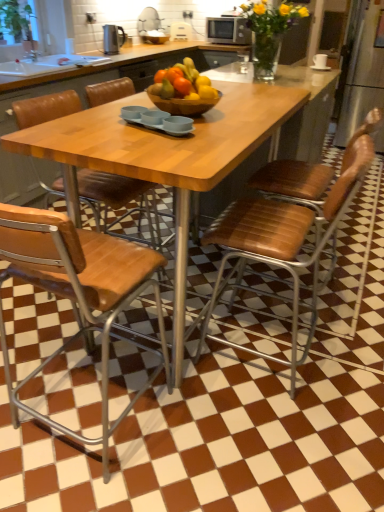
The width and height of the screenshot is (384, 512). What do you see at coordinates (78, 293) in the screenshot?
I see `wooden at center, marked as the second chair in a left-to-right arrangement` at bounding box center [78, 293].

I want to click on wooden at center, which is the 4th chair from right to left, so click(x=117, y=198).

Locate an element on the screen. The height and width of the screenshot is (512, 384). brown leather chair at center, acting as the third chair starting from the left is located at coordinates (282, 242).

Identify the location of wooden table at center. (164, 158).

Is brown leather chair at center, acting as the third chair starting from the left, completely or partially outside of wooden at center, positioned as the first chair in left-to-right order?

That's correct, brown leather chair at center, acting as the third chair starting from the left, is outside of wooden at center, positioned as the first chair in left-to-right order.

Does brown leather chair at center, arranged as the 2th chair when viewed from the right, turn towards wooden at center, which is the 4th chair from right to left?

Yes, brown leather chair at center, arranged as the 2th chair when viewed from the right, faces towards wooden at center, which is the 4th chair from right to left.

Can you confirm if brown leather chair at center, acting as the third chair starting from the left, is wider than wooden at center, positioned as the first chair in left-to-right order?

Correct, the width of brown leather chair at center, acting as the third chair starting from the left, exceeds that of wooden at center, positioned as the first chair in left-to-right order.

The image size is (384, 512). Find the location of `chair that is the 2nd object above the brown leather chair at center, acting as the third chair starting from the left (from a real-world perspective)`. chair that is the 2nd object above the brown leather chair at center, acting as the third chair starting from the left (from a real-world perspective) is located at coordinates [117, 198].

Does wooden table at center lie behind translucent glass vase at upper center?

No, the depth of wooden table at center is less than that of translucent glass vase at upper center.

Which object is thinner, wooden table at center or translucent glass vase at upper center?

translucent glass vase at upper center.

From a real-world perspective, is wooden table at center above or below translucent glass vase at upper center?

Clearly, from a real-world perspective, wooden table at center is below translucent glass vase at upper center.

Locate an element on the screen. The width and height of the screenshot is (384, 512). kitchen & dining room table in front of the translucent glass vase at upper center is located at coordinates (164, 158).

Is wooden at center, marked as the second chair in a left-to-right arrangement, at the left side of matte silver microwave at upper center, acting as the 1th appliance starting from the top?

Indeed, wooden at center, marked as the second chair in a left-to-right arrangement, is positioned on the left side of matte silver microwave at upper center, acting as the 1th appliance starting from the top.

Is matte silver microwave at upper center, which is the first appliance in right-to-left order, a part of wooden at center, arranged as the third chair when viewed from the right?

No, matte silver microwave at upper center, which is the first appliance in right-to-left order, is not a part of wooden at center, arranged as the third chair when viewed from the right.

From the image's perspective, would you say wooden at center, marked as the second chair in a left-to-right arrangement, is positioned over matte silver microwave at upper center, acting as the 1th appliance starting from the top?

No.

Considering the sizes of objects wooden at center, marked as the second chair in a left-to-right arrangement, and matte silver microwave at upper center, which is the first appliance in right-to-left order, in the image provided, who is thinner, wooden at center, marked as the second chair in a left-to-right arrangement, or matte silver microwave at upper center, which is the first appliance in right-to-left order,?

matte silver microwave at upper center, which is the first appliance in right-to-left order.

From the image's perspective, which is below, brown leather chair at center, arranged as the 2th chair when viewed from the right, or matte silver microwave at upper center, which is the 1th appliance in back-to-front order?

brown leather chair at center, arranged as the 2th chair when viewed from the right, from the image's perspective.

Are brown leather chair at center, acting as the third chair starting from the left, and matte silver microwave at upper center, marked as the 2th appliance in a left-to-right arrangement, located far from each other?

Yes, brown leather chair at center, acting as the third chair starting from the left, and matte silver microwave at upper center, marked as the 2th appliance in a left-to-right arrangement, are quite far apart.

Is brown leather chair at center, arranged as the 2th chair when viewed from the right, looking in the opposite direction of matte silver microwave at upper center, which is the 2th appliance in bottom-to-top order?

brown leather chair at center, arranged as the 2th chair when viewed from the right, is not turned away from matte silver microwave at upper center, which is the 2th appliance in bottom-to-top order.

What are the coordinates of `the 2nd appliance above the brown leather chair at center, acting as the third chair starting from the left (from the image's perspective)` in the screenshot? It's located at (228, 30).

From the image's perspective, is brown leather chair at center, acting as the third chair starting from the left, above wooden at center, arranged as the third chair when viewed from the right?

Correct, brown leather chair at center, acting as the third chair starting from the left, appears higher than wooden at center, arranged as the third chair when viewed from the right, in the image.

Are brown leather chair at center, arranged as the 2th chair when viewed from the right, and wooden at center, marked as the second chair in a left-to-right arrangement, located far from each other?

Result: That's not correct — brown leather chair at center, arranged as the 2th chair when viewed from the right, is a little close to wooden at center, marked as the second chair in a left-to-right arrangement.

Is wooden at center, marked as the second chair in a left-to-right arrangement, surrounded by brown leather chair at center, acting as the third chair starting from the left?

No.

Is wooden table at center to the left of black plastic kettle at upper left, which is counted as the first appliance, starting from the left, from the viewer's perspective?

In fact, wooden table at center is to the right of black plastic kettle at upper left, which is counted as the first appliance, starting from the left.

Which is closer to the camera, (135, 104) or (114, 29)?

Point (135, 104) appears to be closer to the viewer than point (114, 29).

Which object is further away from the camera taking this photo, wooden table at center or black plastic kettle at upper left, which is the 2th appliance in top-to-bottom order?

Positioned behind is black plastic kettle at upper left, which is the 2th appliance in top-to-bottom order.

This screenshot has height=512, width=384. I want to click on appliance that is the 1st one above the wooden table at center (from a real-world perspective), so (113, 39).

Looking at this image, is brown leather chair at right, the 1th chair when ordered from right to left, completely or partially outside of matte silver microwave at upper center, which is the 2th appliance in bottom-to-top order?

Yes.

Can you confirm if brown leather chair at right, the 1th chair when ordered from right to left, is taller than matte silver microwave at upper center, which is the 2th appliance in bottom-to-top order?

Yes.

Is brown leather chair at right, the 1th chair when ordered from right to left, turned away from matte silver microwave at upper center, which is the 2th appliance in bottom-to-top order?

No, brown leather chair at right, the 1th chair when ordered from right to left,'s orientation is not away from matte silver microwave at upper center, which is the 2th appliance in bottom-to-top order.

Considering the sizes of brown leather chair at right, which ranks as the 4th chair in left-to-right order, and matte silver microwave at upper center, which is the 2th appliance in bottom-to-top order, in the image, is brown leather chair at right, which ranks as the 4th chair in left-to-right order, wider or thinner than matte silver microwave at upper center, which is the 2th appliance in bottom-to-top order,?

Considering their sizes, brown leather chair at right, which ranks as the 4th chair in left-to-right order, looks broader than matte silver microwave at upper center, which is the 2th appliance in bottom-to-top order.

The image size is (384, 512). In order to click on the 2nd chair to the right of the wooden at center, which is the 4th chair from right to left, counting from the anchor's position in this screenshot , I will do `click(282, 242)`.

Find the location of a particular element. kitchen & dining room table in front of the translucent glass vase at upper center is located at coordinates [164, 158].

Based on their spatial positions, is wooden at center, arranged as the third chair when viewed from the right, or matte silver microwave at upper center, marked as the 2th appliance in a left-to-right arrangement, closer to wooden at center, which is the 4th chair from right to left?

Among the two, wooden at center, arranged as the third chair when viewed from the right, is located nearer to wooden at center, which is the 4th chair from right to left.

From the picture: Considering their positions, is brown leather chair at center, acting as the third chair starting from the left, positioned further to translucent glass vase at upper center than wooden table at center?

Among the two, brown leather chair at center, acting as the third chair starting from the left, is located further to translucent glass vase at upper center.

Considering their positions, is brown leather chair at right, which ranks as the 4th chair in left-to-right order, positioned further to wooden at center, which is the 4th chair from right to left, than matte silver microwave at upper center, marked as the 2th appliance in a left-to-right arrangement?

matte silver microwave at upper center, marked as the 2th appliance in a left-to-right arrangement.

Considering their positions, is wooden table at center positioned closer to brown leather chair at center, acting as the third chair starting from the left, than matte silver microwave at upper center, which is the 1th appliance in back-to-front order?

wooden table at center lies closer to brown leather chair at center, acting as the third chair starting from the left, than the other object.

Considering their positions, is wooden at center, marked as the second chair in a left-to-right arrangement, positioned further to brown leather chair at center, acting as the third chair starting from the left, than wooden bowl at center?

wooden at center, marked as the second chair in a left-to-right arrangement, is further to brown leather chair at center, acting as the third chair starting from the left.

Estimate the real-world distances between objects in this image. Which object is closer to matte silver microwave at upper center, which is the 2th appliance in bottom-to-top order, brown leather chair at center, arranged as the 2th chair when viewed from the right, or brown leather chair at right, which ranks as the 4th chair in left-to-right order?

Among the two, brown leather chair at right, which ranks as the 4th chair in left-to-right order, is located nearer to matte silver microwave at upper center, which is the 2th appliance in bottom-to-top order.

Based on their spatial positions, is translucent glass vase at upper center or black plastic kettle at upper left, placed as the second appliance when sorted from back to front, further from wooden at center, arranged as the third chair when viewed from the right?

black plastic kettle at upper left, placed as the second appliance when sorted from back to front, lies further to wooden at center, arranged as the third chair when viewed from the right, than the other object.

Looking at the image, which one is located further to brown leather chair at center, arranged as the 2th chair when viewed from the right, black plastic kettle at upper left, positioned as the 1th appliance in front-to-back order, or brown leather chair at right, which ranks as the 4th chair in left-to-right order?

black plastic kettle at upper left, positioned as the 1th appliance in front-to-back order, is positioned further to the anchor brown leather chair at center, arranged as the 2th chair when viewed from the right.

I want to click on bowl located between wooden table at center and brown leather chair at right, which ranks as the 4th chair in left-to-right order, in the depth direction, so click(183, 104).

Find the location of `kitchen & dining room table between wooden at center, marked as the second chair in a left-to-right arrangement, and matte silver microwave at upper center, which appears as the 2th appliance when viewed from the front, from front to back`. kitchen & dining room table between wooden at center, marked as the second chair in a left-to-right arrangement, and matte silver microwave at upper center, which appears as the 2th appliance when viewed from the front, from front to back is located at coordinates (164, 158).

Find the location of a particular element. appliance located between wooden table at center and matte silver microwave at upper center, acting as the 1th appliance starting from the top, in the depth direction is located at coordinates (113, 39).

The image size is (384, 512). What are the coordinates of `bowl between wooden at center, which is the 4th chair from right to left, and brown leather chair at right, the 1th chair when ordered from right to left, in the horizontal direction` in the screenshot? It's located at (183, 104).